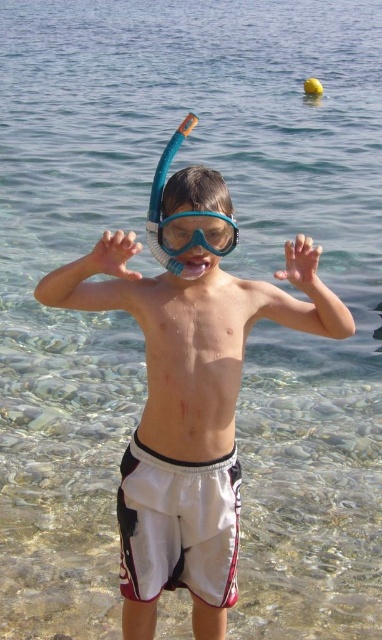
Question: Does blue matte snorkel mask at center appear on the right side of white matte hand at center?

Choices:
 (A) no
 (B) yes

Answer: (A)

Question: Which point is closer to the camera?

Choices:
 (A) translucent plastic hand at center
 (B) blue rubber snorkel at center

Answer: (A)

Question: Which of the following is the closest to the observer?

Choices:
 (A) white matte hand at center
 (B) blue rubber snorkel at center

Answer: (A)

Question: Which point is closer to the camera?

Choices:
 (A) (229, 248)
 (B) (150, 413)
 (C) (124, 250)

Answer: (C)

Question: Is blue matte snorkel mask at center closer to the viewer compared to white matte hand at center?

Choices:
 (A) no
 (B) yes

Answer: (A)

Question: Is translucent plastic hand at center closer to the viewer compared to white matte hand at center?

Choices:
 (A) no
 (B) yes

Answer: (B)